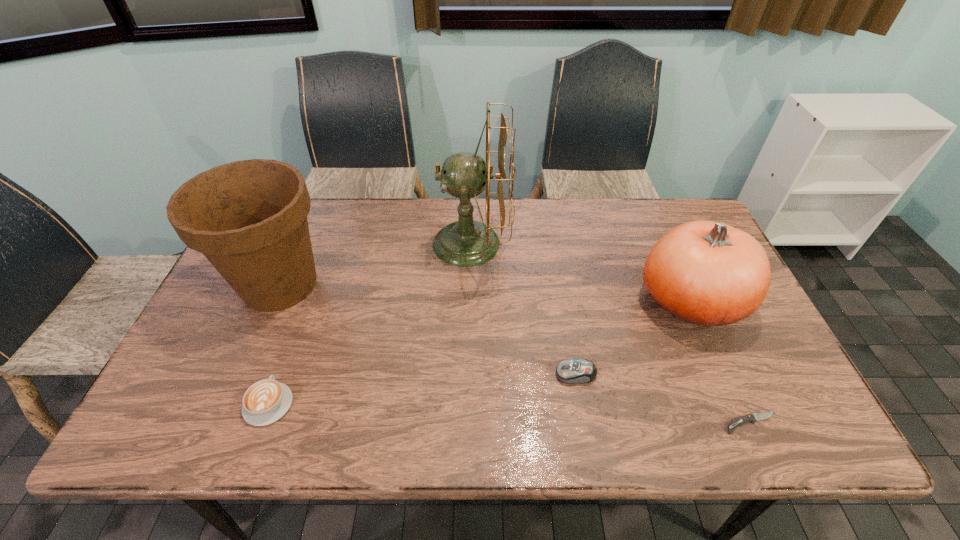
Find the location of a particular element. free spot that satisfies the following two spatial constraints: 1. in front of the tallest object, directing air flow; 2. on the left side of the pumpkin is located at coordinates (469, 301).

This screenshot has height=540, width=960. What are the coordinates of `vacant region that satisfies the following two spatial constraints: 1. on the back side of the shortest object; 2. on the wheel side of the third object from right to left` in the screenshot? It's located at (729, 374).

You are a GUI agent. You are given a task and a screenshot of the screen. Output one action in this format:
    pyautogui.click(x=<x>, y=<y>)
    Task: Click on the vacant space that satisfies the following two spatial constraints: 1. on the wheel side of the shortest object; 2. on the left side of the fourth object from left to right
    The image size is (960, 540).
    Given the screenshot: What is the action you would take?
    pyautogui.click(x=585, y=423)